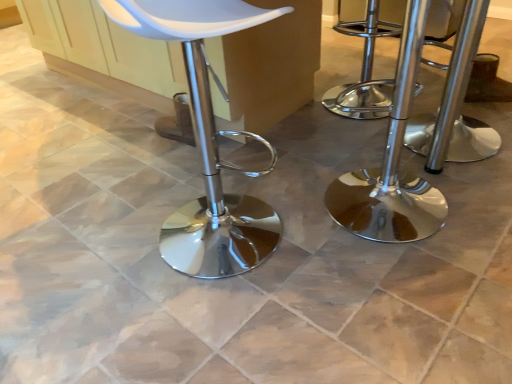
Question: From the image's perspective, is polished chrome stool at center, the first stool when ordered from right to left, over white matte stool at center?

Choices:
 (A) no
 (B) yes

Answer: (B)

Question: Considering the relative positions of polished chrome stool at center, the first stool when ordered from right to left, and white matte stool at center in the image provided, is polished chrome stool at center, the first stool when ordered from right to left, in front of white matte stool at center?

Choices:
 (A) yes
 (B) no

Answer: (B)

Question: From a real-world perspective, is polished chrome stool at center, which is the 2th stool from left to right, below white matte stool at center?

Choices:
 (A) yes
 (B) no

Answer: (A)

Question: Considering the relative sizes of polished chrome stool at center, which is the 2th stool from left to right, and white matte stool at center in the image provided, is polished chrome stool at center, which is the 2th stool from left to right, wider than white matte stool at center?

Choices:
 (A) yes
 (B) no

Answer: (B)

Question: Can you confirm if polished chrome stool at center, the first stool when ordered from right to left, is shorter than white matte stool at center?

Choices:
 (A) yes
 (B) no

Answer: (A)

Question: In terms of size, does polished chrome stool at center, the first stool when ordered from right to left, appear bigger or smaller than white matte stool at center?

Choices:
 (A) small
 (B) big

Answer: (A)

Question: Considering the positions of point (452, 82) and point (271, 218), is point (452, 82) closer or farther from the camera than point (271, 218)?

Choices:
 (A) farther
 (B) closer

Answer: (B)

Question: From a real-world perspective, is polished chrome stool at center, which is the 2th stool from left to right, positioned above or below white matte stool at center?

Choices:
 (A) above
 (B) below

Answer: (B)

Question: From the image's perspective, is polished chrome stool at center, which is the 2th stool from left to right, located above or below white matte stool at center?

Choices:
 (A) below
 (B) above

Answer: (B)

Question: From a real-world perspective, is white matte stool at center positioned above or below chrome/metallic stool at right, the second stool positioned from the right?

Choices:
 (A) below
 (B) above

Answer: (B)

Question: Would you say white matte stool at center is inside or outside chrome/metallic stool at right, the second stool positioned from the right?

Choices:
 (A) outside
 (B) inside

Answer: (A)

Question: Is white matte stool at center to the left or to the right of chrome/metallic stool at right, the second stool positioned from the right, in the image?

Choices:
 (A) left
 (B) right

Answer: (A)

Question: Is point (209, 157) positioned closer to the camera than point (446, 210)?

Choices:
 (A) closer
 (B) farther

Answer: (B)

Question: Is polished chrome stool at center, which is the 2th stool from left to right, taller or shorter than chrome/metallic stool at right, acting as the first stool starting from the left?

Choices:
 (A) tall
 (B) short

Answer: (B)

Question: Is point (479, 132) positioned closer to the camera than point (409, 46)?

Choices:
 (A) closer
 (B) farther

Answer: (B)